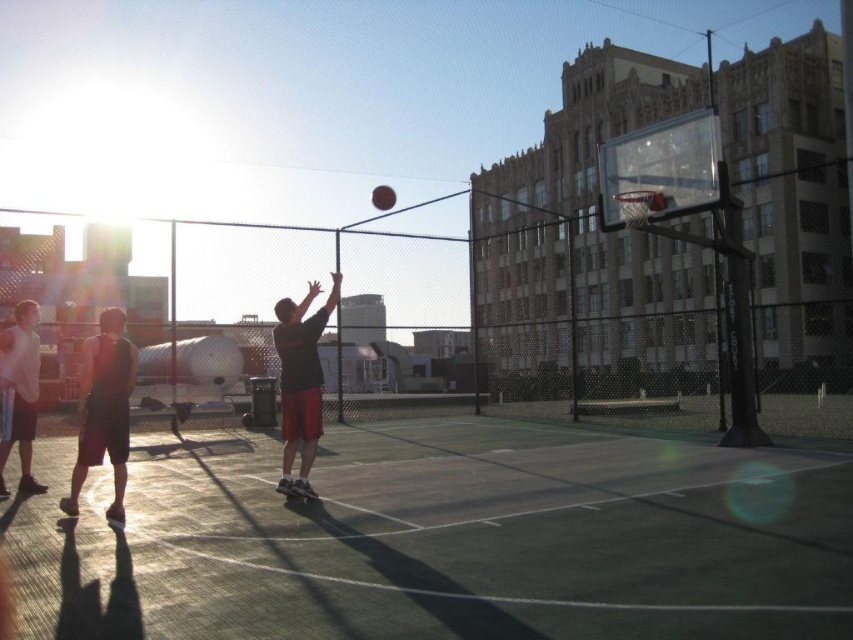
Question: Which point appears closest to the camera in this image?

Choices:
 (A) (111, 506)
 (B) (276, 515)

Answer: (A)

Question: Does green rubber court at center have a larger size compared to black matte shorts at left?

Choices:
 (A) no
 (B) yes

Answer: (B)

Question: Considering the real-world distances, which object is farthest from the matte black shirt at center?

Choices:
 (A) matte black shorts at left
 (B) black matte shorts at left

Answer: (A)

Question: Can you confirm if black matte shorts at left is positioned below matte black shorts at left?

Choices:
 (A) yes
 (B) no

Answer: (A)

Question: In this image, where is green rubber court at center located relative to matte black shirt at center?

Choices:
 (A) above
 (B) below

Answer: (B)

Question: Which object appears farthest from the camera in this image?

Choices:
 (A) green rubber court at center
 (B) matte black shirt at center
 (C) matte black shorts at left
 (D) black matte shorts at left

Answer: (C)